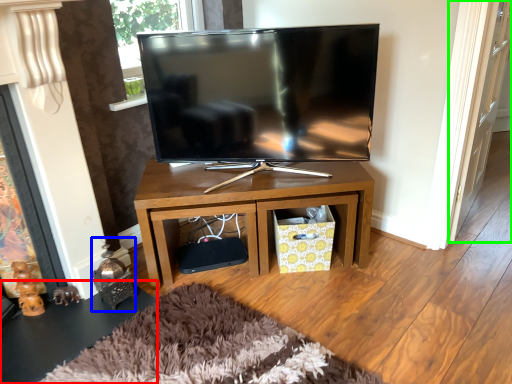
Question: Considering the real-world distances, which object is farthest from side table (highlighted by a red box)? toy (highlighted by a blue box) or glass door (highlighted by a green box)?

Choices:
 (A) toy
 (B) glass door

Answer: (B)